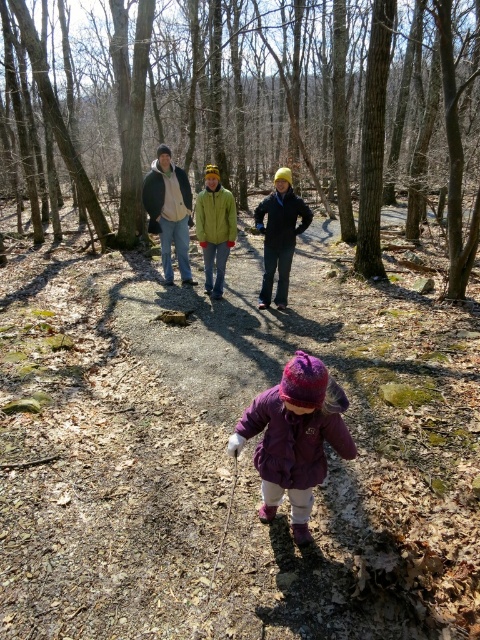
You are a hiker planning to join the group walking along the forest trail. You want to know if there is enough space between the purple fleece jacket at center and the dark gray jacket at center to fit your 10 feet long backpack. Can you confirm?

The purple fleece jacket at center and dark gray jacket at center are 20.03 feet apart from each other. Since the distance between them is greater than 10 feet, your backpack can fit between them.